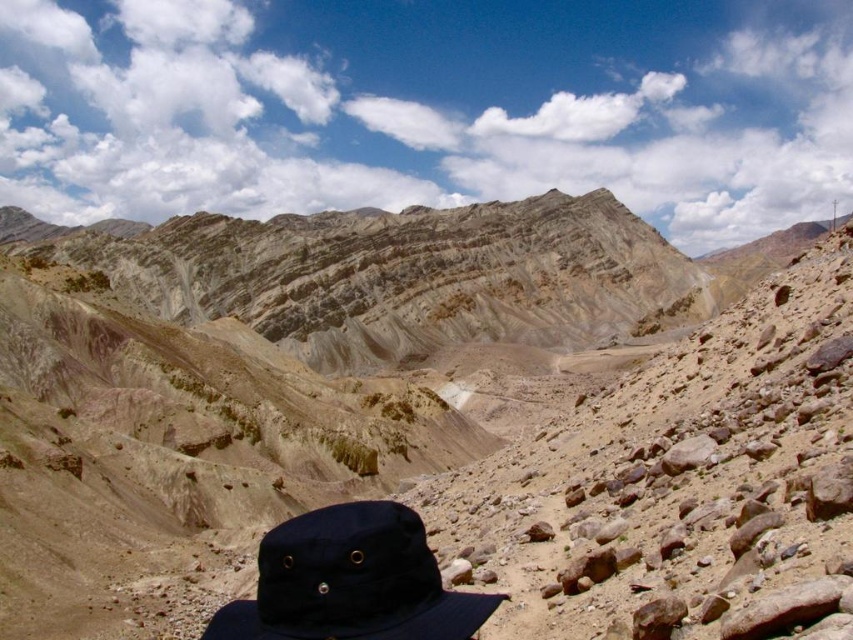
Question: Is matte brown rock at center positioned before navy blue fabric baseball hat at lower center?

Choices:
 (A) yes
 (B) no

Answer: (B)

Question: Which point is farther to the camera?

Choices:
 (A) matte brown rock at center
 (B) navy blue fabric baseball hat at lower center

Answer: (A)

Question: Which of the following is the farthest from the observer?

Choices:
 (A) matte brown rock at center
 (B) navy blue fabric baseball hat at lower center

Answer: (A)

Question: Where is matte brown rock at center located in relation to navy blue fabric baseball hat at lower center in the image?

Choices:
 (A) below
 (B) above

Answer: (B)

Question: Does matte brown rock at center appear on the left side of navy blue fabric baseball hat at lower center?

Choices:
 (A) yes
 (B) no

Answer: (A)

Question: Which point is closer to the camera taking this photo?

Choices:
 (A) (427, 620)
 (B) (233, 544)

Answer: (A)